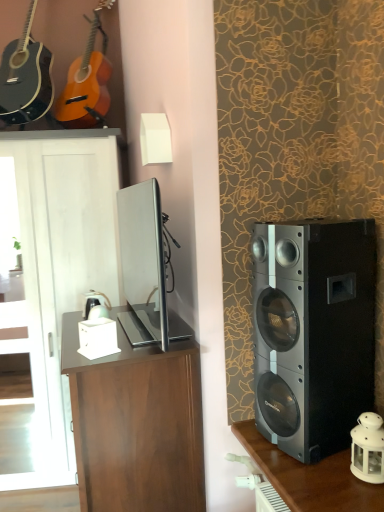
Where is `vacant point above dark wood shelf at right (from a real-world perspective)`? Image resolution: width=384 pixels, height=512 pixels. vacant point above dark wood shelf at right (from a real-world perspective) is located at coordinates (309, 467).